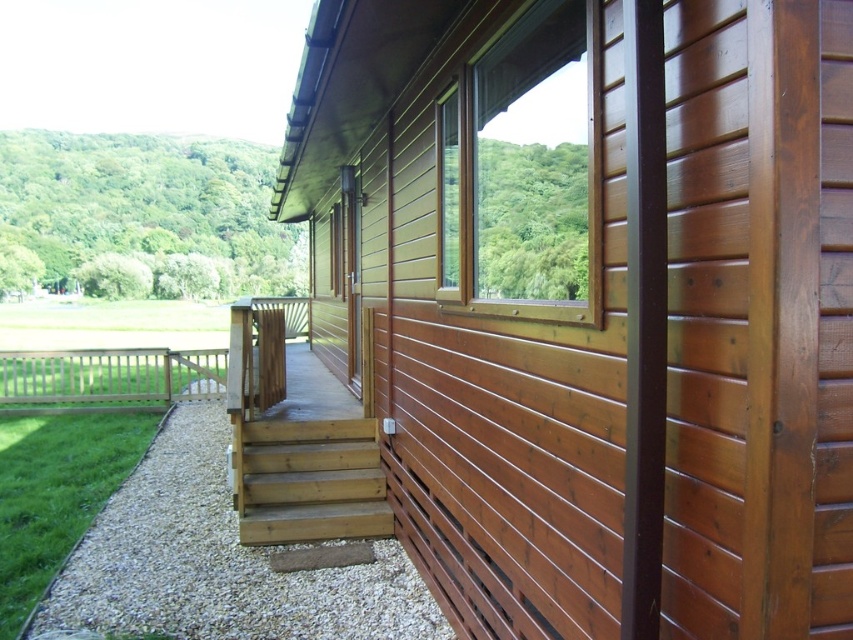
You are standing at the base of the natural wood stairs at center and want to look up to the brown wooden window at center. Is the window above or below your current position?

The brown wooden window at center is above the natural wood stairs at center, so the window is above your current position.

You are standing at the entrance of the wooden building and want to walk to the white gravel at lower left. Which direction should you go relative to the brown wooden balustrade at left?

To reach the white gravel at lower left, you should move towards the lower left direction, which is under the brown wooden balustrade at left.